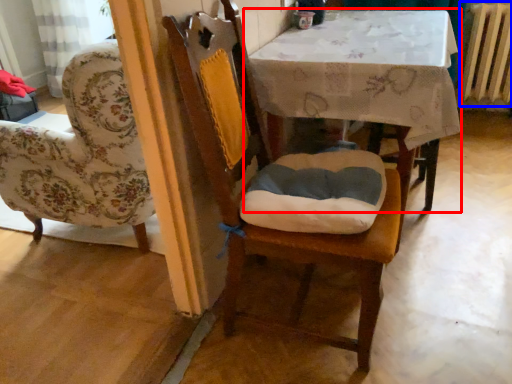
Question: Which point is further to the camera, table (highlighted by a red box) or radiator (highlighted by a blue box)?

Choices:
 (A) table
 (B) radiator

Answer: (B)